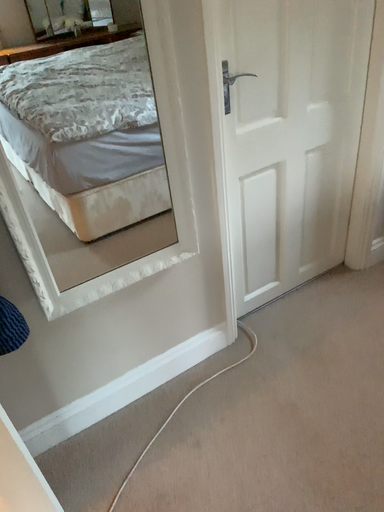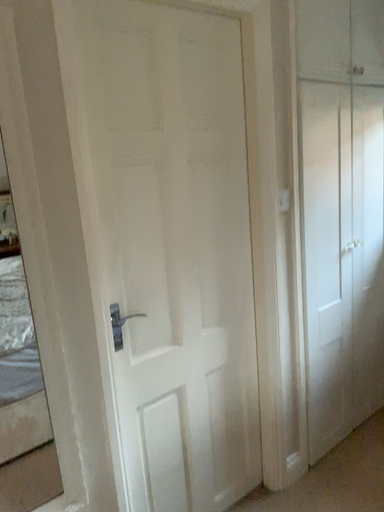
Question: How did the camera likely rotate when shooting the video?

Choices:
 (A) rotated downward
 (B) rotated upward

Answer: (B)